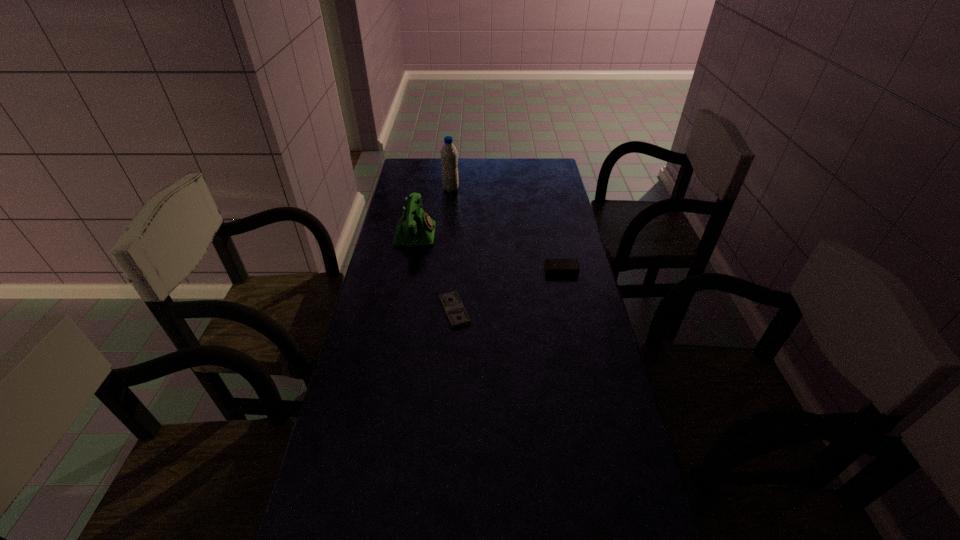
You are a GUI agent. You are given a task and a screenshot of the screen. Output one action in this format:
    pyautogui.click(x=<x>, y=<y>)
    Task: Click on the free space that satisfies the following two spatial constraints: 1. on the dial of the leftmost object; 2. on the back side of the nearest object
    The height and width of the screenshot is (540, 960).
    Given the screenshot: What is the action you would take?
    pyautogui.click(x=401, y=310)

The height and width of the screenshot is (540, 960). I want to click on free space that satisfies the following two spatial constraints: 1. on the dial of the leftmost object; 2. on the right side of the shortest object, so click(401, 310).